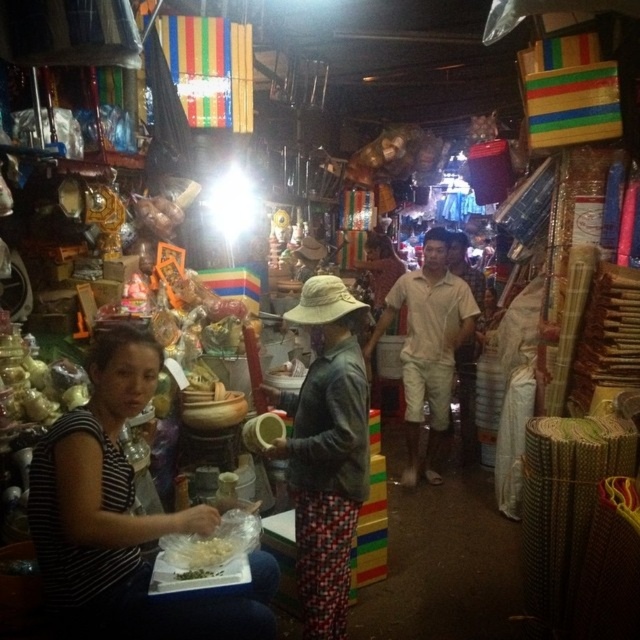
Based on the photo, you are a customer at the market and want to grab both the striped fabric shirt at lower left and the white matte food at lower left. Which one should you pick up first to avoid knocking over the other?

You should pick up the white matte food at lower left first because the striped fabric shirt at lower left is located above it, so reaching for the shirt might disturb the food below.

You are a customer at the market and want to buy both the leather jacket at center and the white matte food at lower left. You have a small bag that can only carry items narrower than 30 cm. Which item can you safely put in your bag first?

The white matte food at lower left can be safely put in your bag first since its width is smaller than the leather jacket at center, and your bag can only carry items narrower than 30 cm.